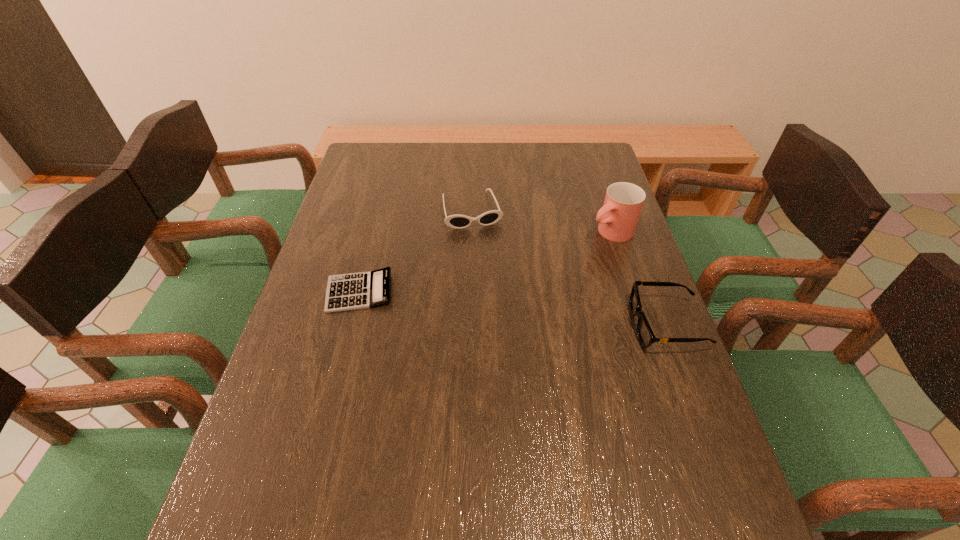
Where is `free space between the tallest object and the nearer sunglasses`? free space between the tallest object and the nearer sunglasses is located at coordinates (638, 278).

Identify the location of free spot between the third object from right to left and the tallest object. The height and width of the screenshot is (540, 960). (541, 221).

You are a GUI agent. You are given a task and a screenshot of the screen. Output one action in this format:
    pyautogui.click(x=<x>, y=<y>)
    Task: Click on the free point between the left sunglasses and the shortest object
    
    Given the screenshot: What is the action you would take?
    pyautogui.click(x=416, y=251)

In order to click on free space between the calculator and the second object from left to right in this screenshot , I will do `click(416, 251)`.

Locate an element on the screen. This screenshot has height=540, width=960. vacant space in between the right sunglasses and the leftmost object is located at coordinates (513, 308).

The width and height of the screenshot is (960, 540). I want to click on empty space that is in between the left sunglasses and the shortest object, so click(x=416, y=251).

Locate which object ranks in proximity to the calculator. Please provide its 2D coordinates. Your answer should be formatted as a tuple, i.e. [(x, y)], where the tuple contains the x and y coordinates of a point satisfying the conditions above.

[(488, 218)]

Locate which object ranks third in proximity to the leftmost object. Please provide its 2D coordinates. Your answer should be formatted as a tuple, i.e. [(x, y)], where the tuple contains the x and y coordinates of a point satisfying the conditions above.

[(645, 334)]

Image resolution: width=960 pixels, height=540 pixels. Identify the location of free space in the image that satisfies the following two spatial constraints: 1. on the front side of the right sunglasses; 2. on the front-facing side of the cup. (640, 325).

Identify the location of free space that satisfies the following two spatial constraints: 1. on the back side of the cup; 2. on the right side of the leftmost object. The height and width of the screenshot is (540, 960). (375, 232).